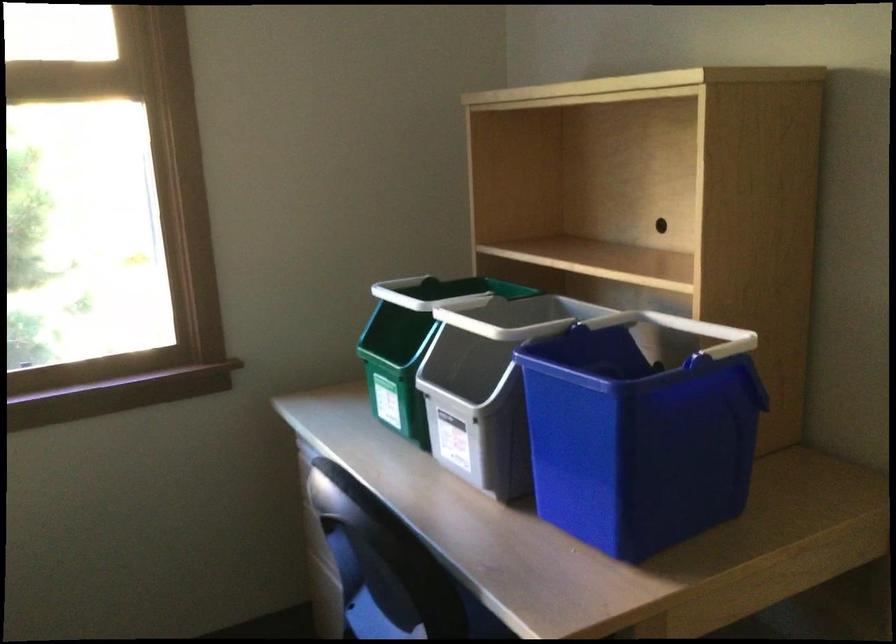
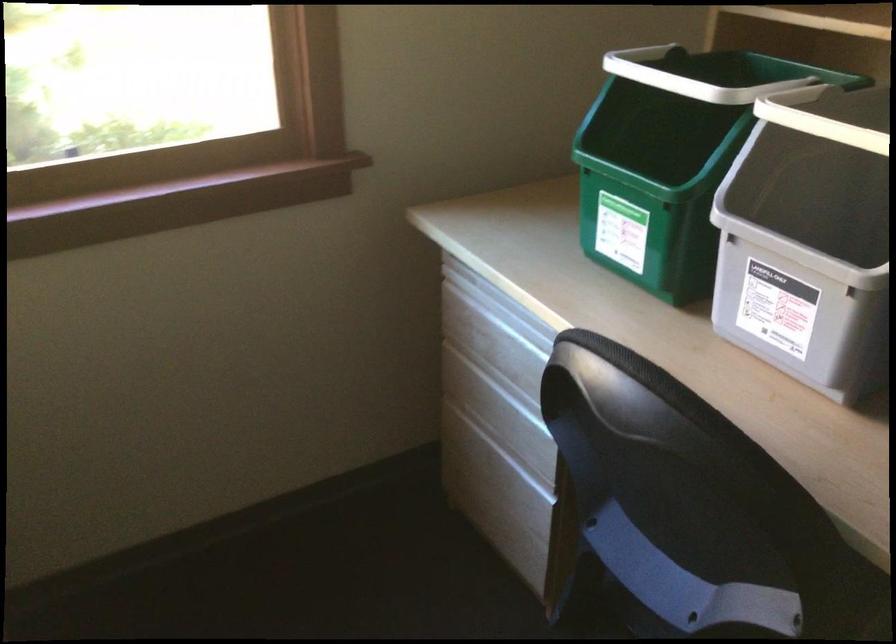
What movement of the cameraman would produce the second image?

The cameraman moved toward left, forward.